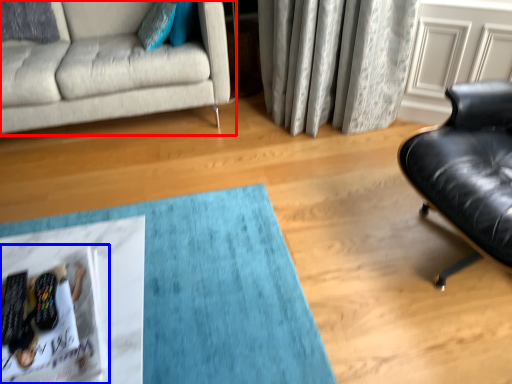
Question: Which of the following is the closest to the observer, studio couch (highlighted by a red box) or magazine (highlighted by a blue box)?

Choices:
 (A) studio couch
 (B) magazine

Answer: (B)